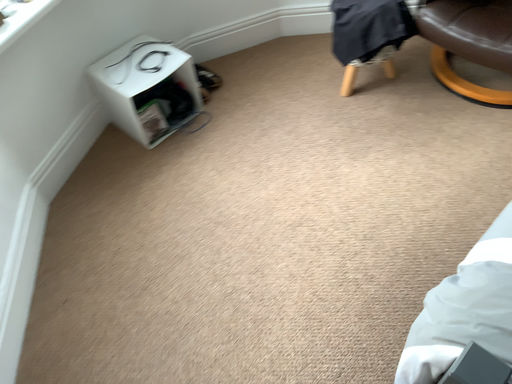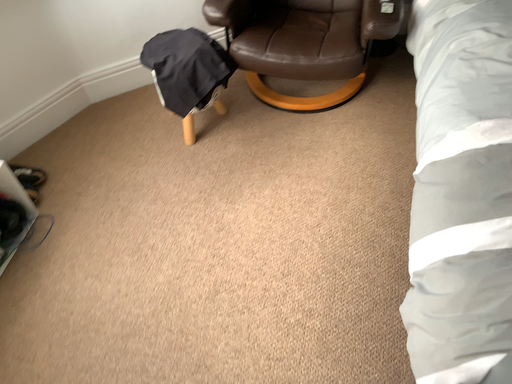
Question: Which way did the camera rotate in the video?

Choices:
 (A) rotated right
 (B) rotated left

Answer: (A)